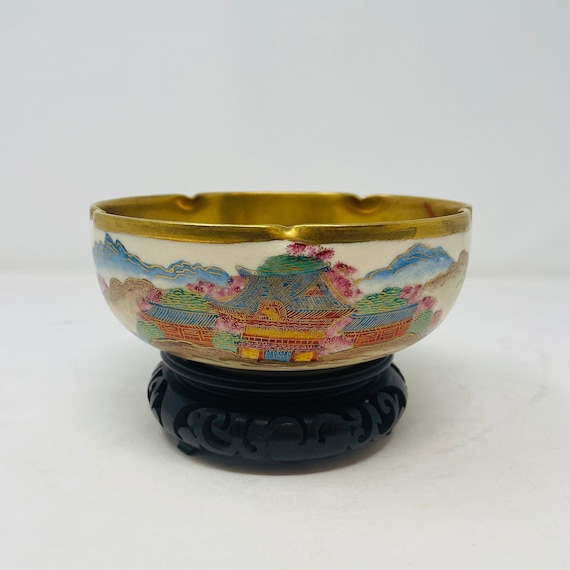
In order to click on table in this screenshot , I will do `click(44, 403)`, `click(491, 405)`, `click(298, 540)`.